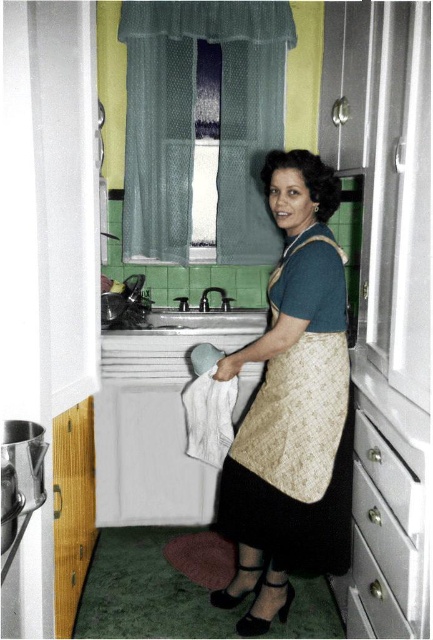
Does matte gold apron at center have a smaller size compared to metallic silver drawer at lower right?

Incorrect, matte gold apron at center is not smaller in size than metallic silver drawer at lower right.

Describe the element at coordinates (291, 406) in the screenshot. I see `matte gold apron at center` at that location.

Locate an element on the screen. matte gold apron at center is located at coordinates (291, 406).